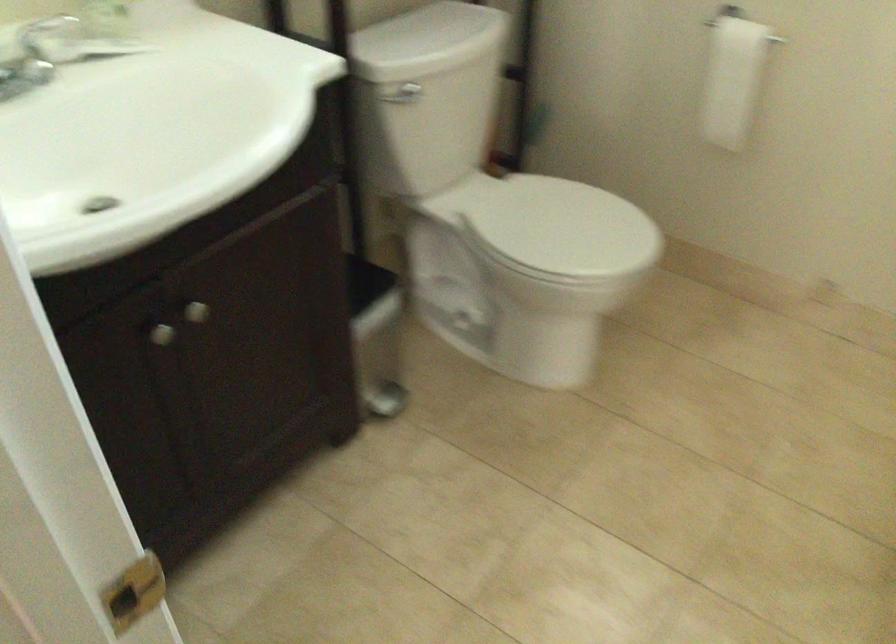
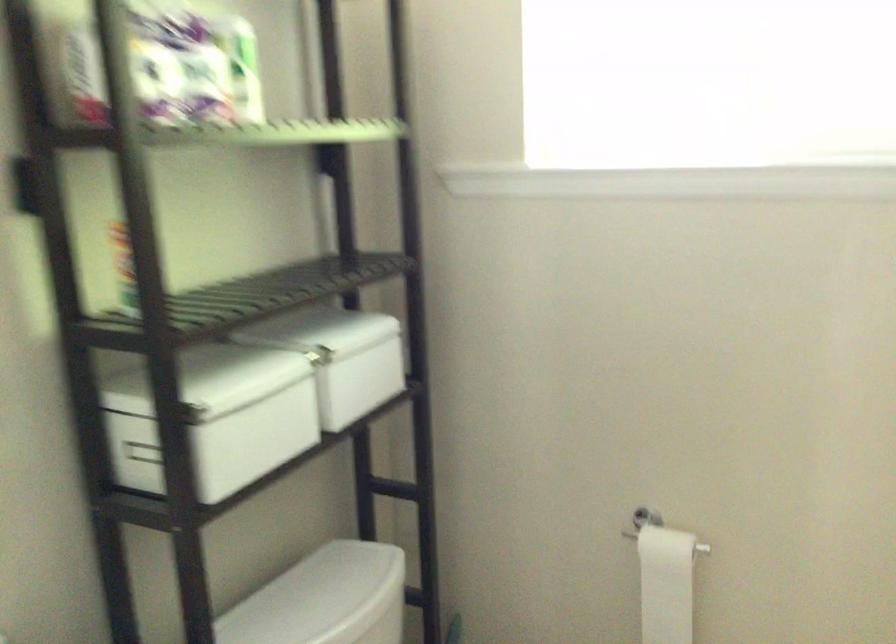
In the second image, find the point that corresponds to point 735,76 in the first image.

(666, 583)